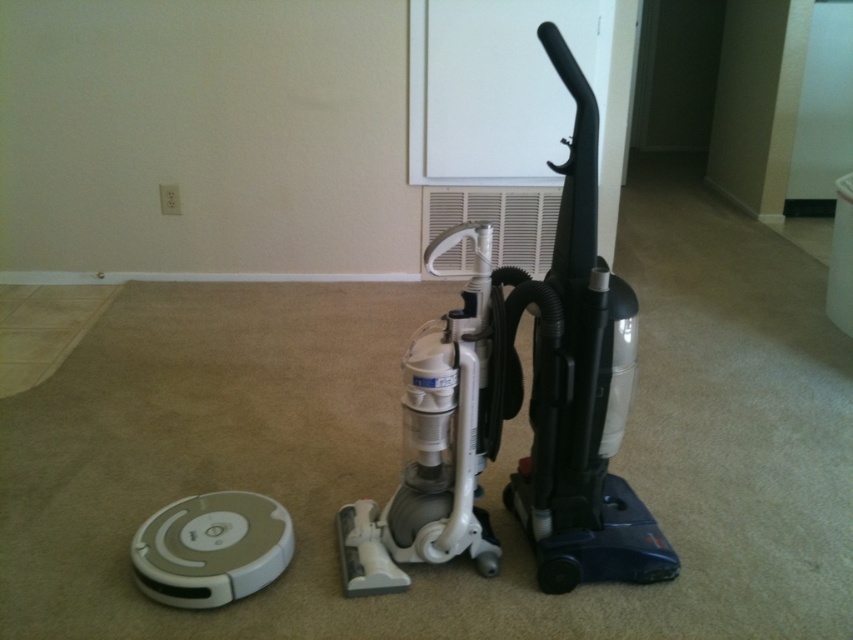
Question: Which of the following is the closest to the observer?

Choices:
 (A) (430, 241)
 (B) (270, 508)

Answer: (B)

Question: Can you confirm if white plastic robot vacuum cleaner at lower left is wider than white plastic air conditioner at center?

Choices:
 (A) no
 (B) yes

Answer: (A)

Question: Which object appears farthest from the camera in this image?

Choices:
 (A) white plastic robot vacuum cleaner at lower left
 (B) white plastic air conditioner at center

Answer: (B)

Question: Is white plastic robot vacuum cleaner at lower left thinner than white plastic air conditioner at center?

Choices:
 (A) yes
 (B) no

Answer: (A)

Question: Can you confirm if white plastic robot vacuum cleaner at lower left is bigger than white plastic air conditioner at center?

Choices:
 (A) yes
 (B) no

Answer: (B)